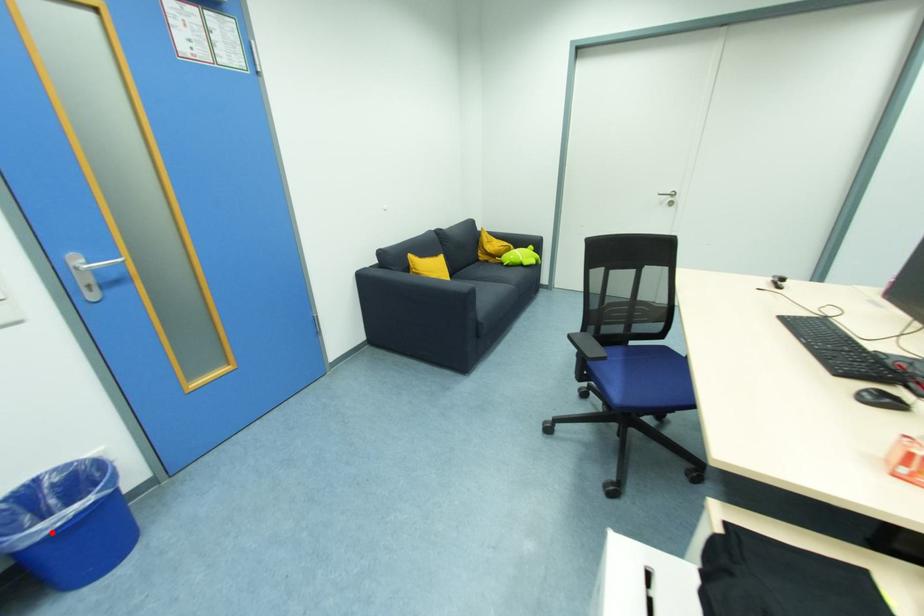
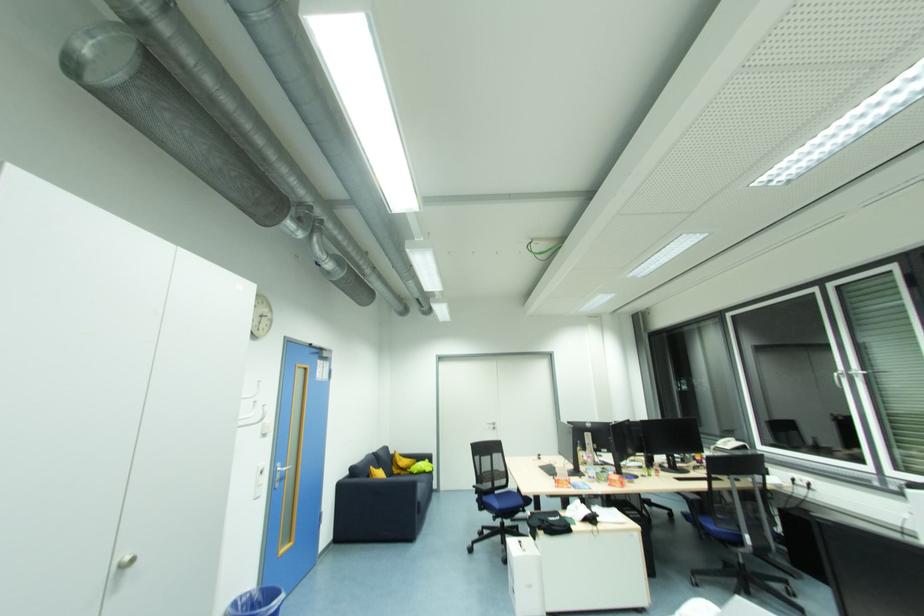
In the second image, find the point that corresponds to the highlighted location in the first image.

(280, 607)